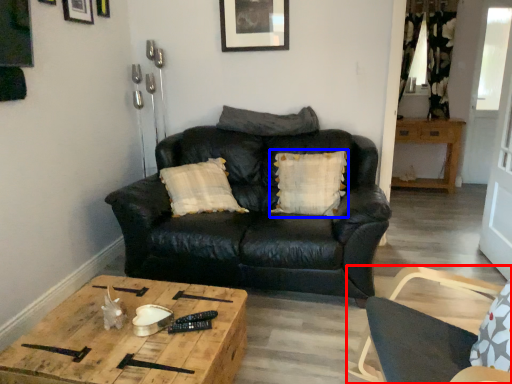
Question: Among these objects, which one is nearest to the camera, chair (highlighted by a red box) or pillow (highlighted by a blue box)?

Choices:
 (A) chair
 (B) pillow

Answer: (A)